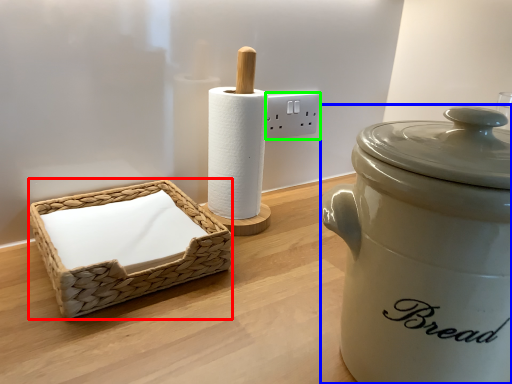
Question: Which object is the closest to the basket (highlighted by a red box)? Choose among these: rice cooker (highlighted by a blue box) or electric outlet (highlighted by a green box).

Choices:
 (A) rice cooker
 (B) electric outlet

Answer: (A)